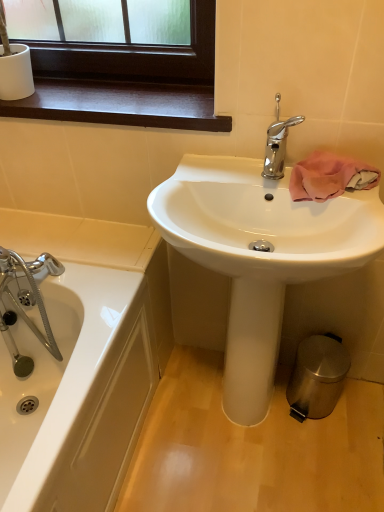
The height and width of the screenshot is (512, 384). Find the location of `vacant area to the right of polished stainless steel trash can at lower right`. vacant area to the right of polished stainless steel trash can at lower right is located at coordinates (357, 408).